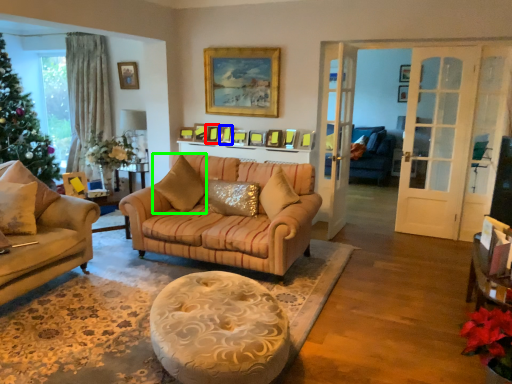
Question: Based on their relative distances, which object is nearer to picture frame (highlighted by a red box)? Choose from picture frame (highlighted by a blue box) and pillow (highlighted by a green box).

Choices:
 (A) picture frame
 (B) pillow

Answer: (A)